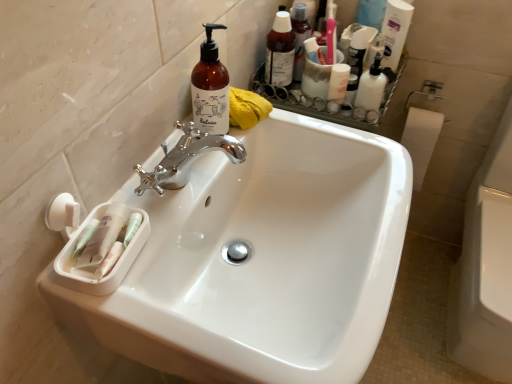
Question: Does white glossy sink at center appear on the left side of brown glass bottle at upper center, arranged as the second cleaning product when viewed from the back?

Choices:
 (A) yes
 (B) no

Answer: (B)

Question: From the image's perspective, is white glossy sink at center on brown glass bottle at upper center, which appears as the second cleaning product when viewed from the right?

Choices:
 (A) no
 (B) yes

Answer: (A)

Question: Does white glossy sink at center lie in front of brown glass bottle at upper center, the first cleaning product in the front-to-back sequence?

Choices:
 (A) yes
 (B) no

Answer: (A)

Question: From a real-world perspective, is white glossy sink at center physically above brown glass bottle at upper center, which appears as the second cleaning product when viewed from the right?

Choices:
 (A) no
 (B) yes

Answer: (A)

Question: Is white glossy sink at center turned away from brown glass bottle at upper center, the first cleaning product in the left-to-right sequence?

Choices:
 (A) no
 (B) yes

Answer: (A)

Question: Is white glossy lotion at upper right, marked as the second toiletry in a left-to-right arrangement, bigger or smaller than white glossy mouthwash at upper right?

Choices:
 (A) big
 (B) small

Answer: (A)

Question: Is point click(x=371, y=87) positioned closer to the camera than point click(x=343, y=84)?

Choices:
 (A) farther
 (B) closer

Answer: (B)

Question: From the image's perspective, is white glossy lotion at upper right, marked as the second toiletry in a left-to-right arrangement, positioned above or below white glossy mouthwash at upper right?

Choices:
 (A) below
 (B) above

Answer: (A)

Question: Relative to white glossy mouthwash at upper right, is white glossy lotion at upper right, marked as the second toiletry in a left-to-right arrangement, in front or behind?

Choices:
 (A) front
 (B) behind

Answer: (A)

Question: Is translucent plastic bottles at upper right, marked as the 1th toiletry in a left-to-right arrangement, situated inside white glossy lotion at upper right, which is counted as the first toiletry, starting from the right, or outside?

Choices:
 (A) outside
 (B) inside

Answer: (A)

Question: Based on their positions, is translucent plastic bottles at upper right, which ranks as the 2th toiletry in right-to-left order, located to the left or right of white glossy lotion at upper right, marked as the second toiletry in a left-to-right arrangement?

Choices:
 (A) left
 (B) right

Answer: (A)

Question: Is translucent plastic bottles at upper right, which ranks as the 2th toiletry in right-to-left order, bigger or smaller than white glossy lotion at upper right, which is counted as the first toiletry, starting from the right?

Choices:
 (A) big
 (B) small

Answer: (A)

Question: From the image's perspective, is translucent plastic bottles at upper right, which ranks as the 2th toiletry in right-to-left order, positioned above or below white glossy lotion at upper right, marked as the second toiletry in a left-to-right arrangement?

Choices:
 (A) below
 (B) above

Answer: (B)

Question: In terms of size, does white glossy sink at center appear bigger or smaller than translucent plastic pump bottle at upper right, placed as the second cleaning product when sorted from front to back?

Choices:
 (A) big
 (B) small

Answer: (A)

Question: Relative to translucent plastic pump bottle at upper right, which appears as the second cleaning product when ordered from the bottom, is white glossy sink at center in front or behind?

Choices:
 (A) front
 (B) behind

Answer: (A)